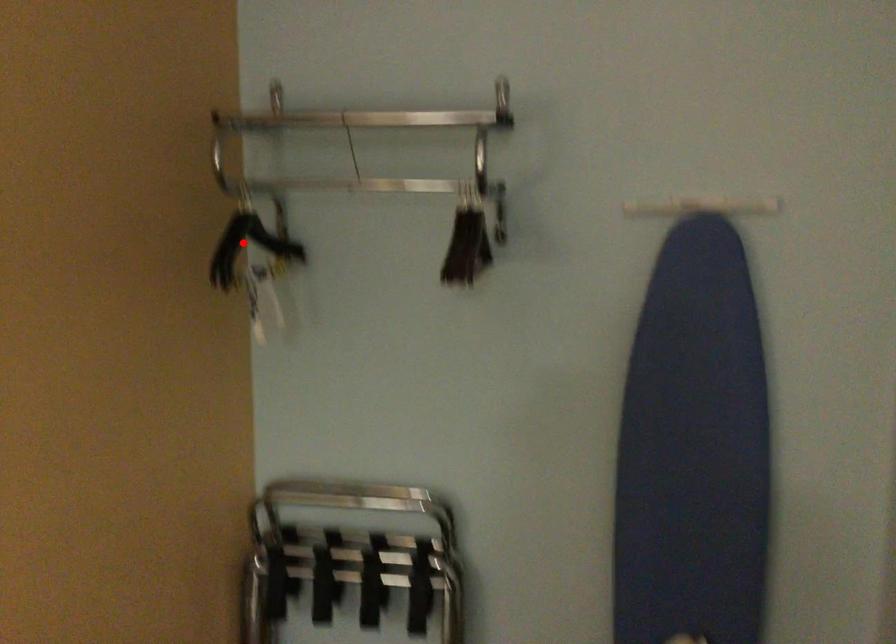
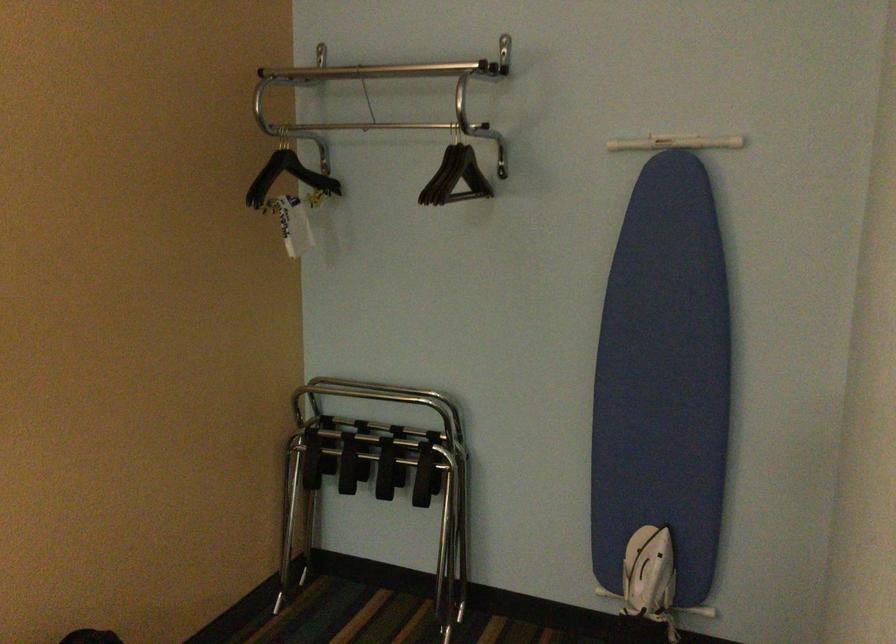
Question: I am providing you with two images of the same scene from different viewpoints. A red point is shown in image1. For the corresponding object point in image2, is it positioned nearer or farther from the camera?

Choices:
 (A) Nearer
 (B) Farther

Answer: (B)